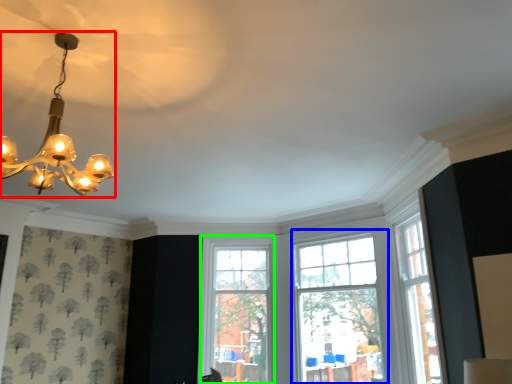
Question: Considering the real-world distances, which object is farthest from lamp (highlighted by a red box)? window (highlighted by a blue box) or window (highlighted by a green box)?

Choices:
 (A) window
 (B) window

Answer: (B)